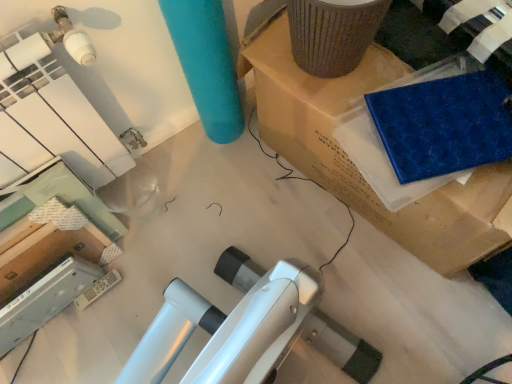
Question: In the image, is blue rubber mat at upper right positioned in front of or behind blue sponge at upper right?

Choices:
 (A) front
 (B) behind

Answer: (A)

Question: Based on their positions, is blue rubber mat at upper right located to the left or right of blue sponge at upper right?

Choices:
 (A) right
 (B) left

Answer: (A)

Question: From the image's perspective, is blue rubber mat at upper right located above or below blue sponge at upper right?

Choices:
 (A) below
 (B) above

Answer: (B)

Question: In terms of size, does blue sponge at upper right appear bigger or smaller than blue rubber mat at upper right?

Choices:
 (A) big
 (B) small

Answer: (B)

Question: Is blue sponge at upper right wider or thinner than blue rubber mat at upper right?

Choices:
 (A) thin
 (B) wide

Answer: (A)

Question: In the image, is blue sponge at upper right positioned in front of or behind blue rubber mat at upper right?

Choices:
 (A) front
 (B) behind

Answer: (B)

Question: From the image's perspective, is blue sponge at upper right positioned above or below blue rubber mat at upper right?

Choices:
 (A) above
 (B) below

Answer: (B)